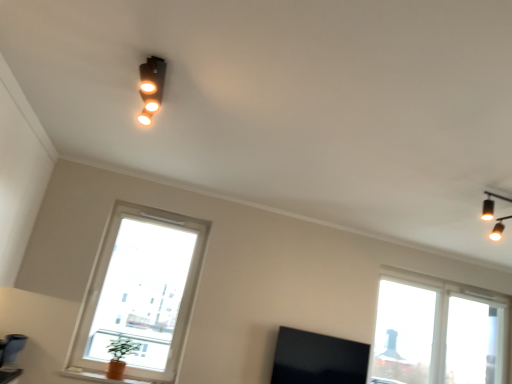
Question: From the image's perspective, would you say green leafy plant at lower left is shown under white plastic window frame at right?

Choices:
 (A) yes
 (B) no

Answer: (B)

Question: From a real-world perspective, is green leafy plant at lower left physically above white plastic window frame at right?

Choices:
 (A) no
 (B) yes

Answer: (A)

Question: Considering the relative sizes of green leafy plant at lower left and white plastic window frame at right in the image provided, is green leafy plant at lower left thinner than white plastic window frame at right?

Choices:
 (A) no
 (B) yes

Answer: (A)

Question: Is green leafy plant at lower left far away from white plastic window frame at right?

Choices:
 (A) yes
 (B) no

Answer: (A)

Question: Is green leafy plant at lower left next to white plastic window frame at right?

Choices:
 (A) no
 (B) yes

Answer: (A)

Question: Considering the relative sizes of green leafy plant at lower left and white plastic window frame at right in the image provided, is green leafy plant at lower left taller than white plastic window frame at right?

Choices:
 (A) yes
 (B) no

Answer: (B)

Question: Is matte orange vase at lower left wider than matte black spotlight at upper center?

Choices:
 (A) yes
 (B) no

Answer: (A)

Question: From a real-world perspective, does matte orange vase at lower left stand above matte black spotlight at upper center?

Choices:
 (A) no
 (B) yes

Answer: (A)

Question: Considering the relative sizes of matte orange vase at lower left and matte black spotlight at upper center in the image provided, is matte orange vase at lower left smaller than matte black spotlight at upper center?

Choices:
 (A) no
 (B) yes

Answer: (B)

Question: Would you say matte orange vase at lower left is outside matte black spotlight at upper center?

Choices:
 (A) yes
 (B) no

Answer: (A)

Question: Does matte orange vase at lower left appear on the left side of matte black spotlight at upper center?

Choices:
 (A) no
 (B) yes

Answer: (B)

Question: Can you confirm if matte orange vase at lower left is thinner than matte black spotlight at upper center?

Choices:
 (A) yes
 (B) no

Answer: (B)

Question: Is green leafy plant at lower left positioned far away from black matte tv at lower center?

Choices:
 (A) yes
 (B) no

Answer: (A)